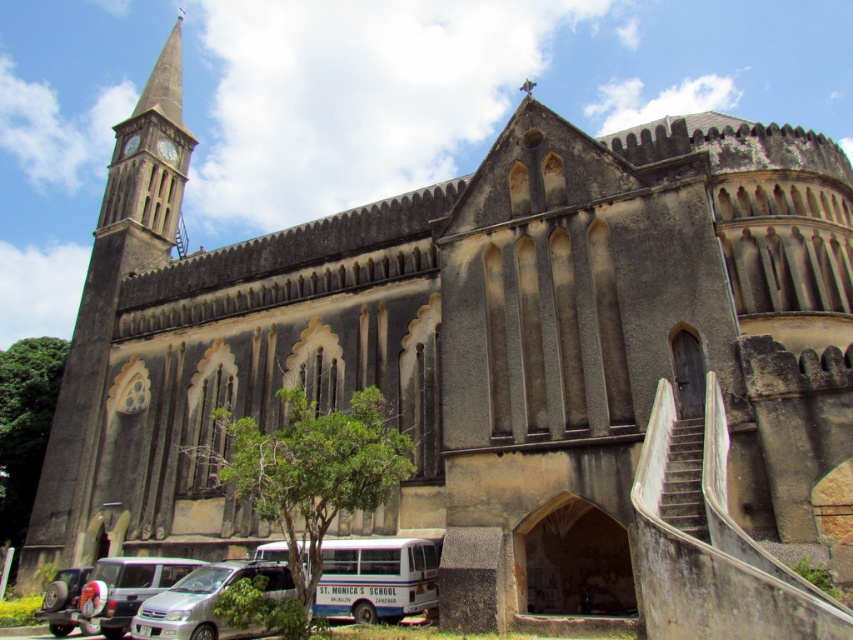
Can you confirm if white matte bus at lower center is positioned to the left of silver metallic car at lower left?

In fact, white matte bus at lower center is to the right of silver metallic car at lower left.

Does white matte bus at lower center appear under silver metallic car at lower left?

No.

Does point (335, 568) come behind point (120, 588)?

Yes, point (335, 568) is farther from viewer.

Identify the location of white matte bus at lower center. (376, 579).

From the picture: Can you confirm if silver metallic car at lower left is positioned below silver metallic van at lower left?

Yes, silver metallic car at lower left is below silver metallic van at lower left.

Does silver metallic car at lower left have a greater height compared to silver metallic van at lower left?

Yes.

Between point (57, 627) and point (252, 570), which one is positioned behind?

The point (57, 627) is behind.

At what (x,y) coordinates should I click in order to perform the action: click on silver metallic car at lower left. Please return your answer as a coordinate pair (x, y). The height and width of the screenshot is (640, 853). Looking at the image, I should click on (107, 593).

Can you confirm if white matte bus at lower center is smaller than silver metallic van at lower left?

Indeed, white matte bus at lower center has a smaller size compared to silver metallic van at lower left.

Does white matte bus at lower center have a greater height compared to silver metallic van at lower left?

In fact, white matte bus at lower center may be shorter than silver metallic van at lower left.

The height and width of the screenshot is (640, 853). Describe the element at coordinates (376, 579) in the screenshot. I see `white matte bus at lower center` at that location.

At what (x,y) coordinates should I click in order to perform the action: click on white matte bus at lower center. Please return your answer as a coordinate pair (x, y). Looking at the image, I should click on (376, 579).